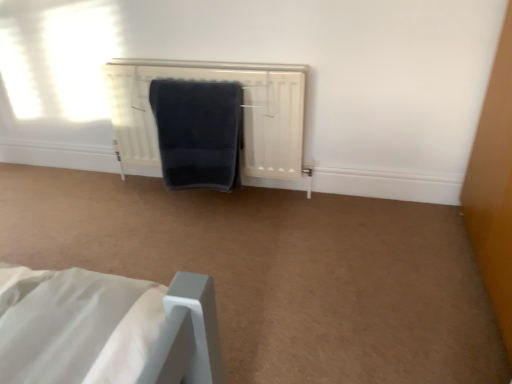
Question: Visually, is dark blue textured towel at center positioned to the left or to the right of white matte radiator at center?

Choices:
 (A) left
 (B) right

Answer: (A)

Question: Considering the positions of dark blue textured towel at center and white matte radiator at center in the image, is dark blue textured towel at center wider or thinner than white matte radiator at center?

Choices:
 (A) wide
 (B) thin

Answer: (B)

Question: From their relative heights in the image, would you say dark blue textured towel at center is taller or shorter than white matte radiator at center?

Choices:
 (A) tall
 (B) short

Answer: (B)

Question: In the image, is white matte radiator at center on the left side or the right side of dark blue textured towel at center?

Choices:
 (A) right
 (B) left

Answer: (A)

Question: Is white matte radiator at center in front of or behind dark blue textured towel at center in the image?

Choices:
 (A) behind
 (B) front

Answer: (A)

Question: Is white matte radiator at center spatially inside dark blue textured towel at center, or outside of it?

Choices:
 (A) inside
 (B) outside

Answer: (B)

Question: From a real-world perspective, relative to dark blue textured towel at center, is white matte radiator at center vertically above or below?

Choices:
 (A) above
 (B) below

Answer: (B)